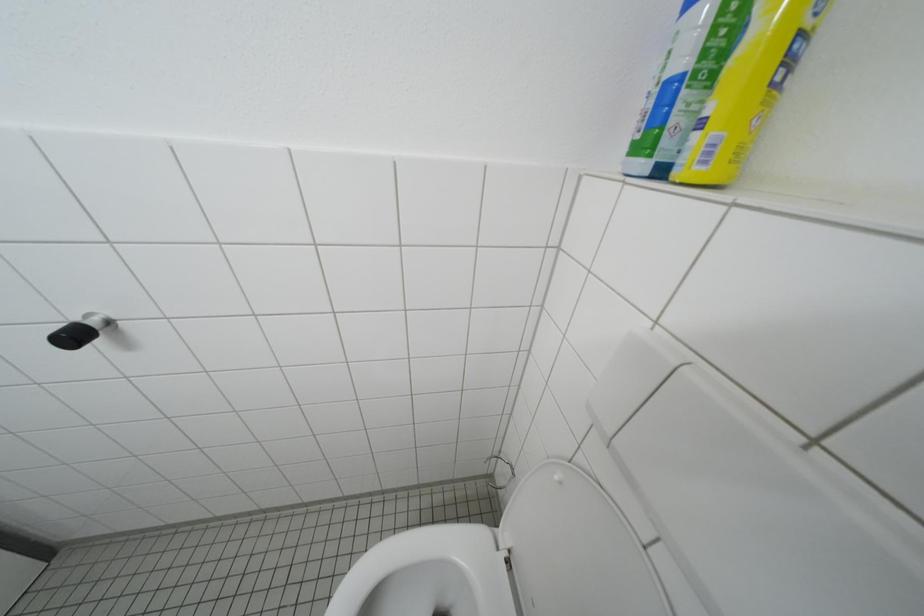
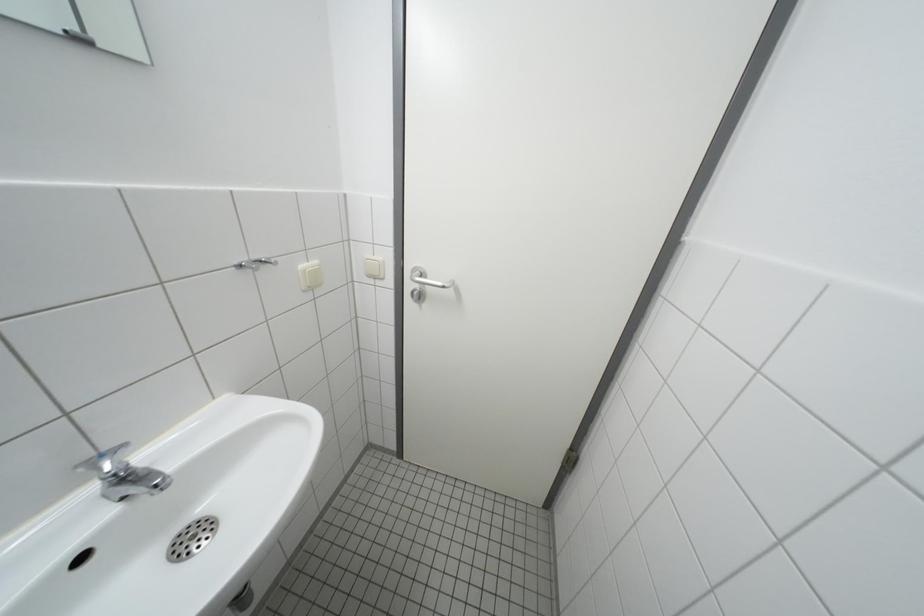
First-person continuous shooting, in which direction is the camera rotating?

The camera's rotation is toward left-down.